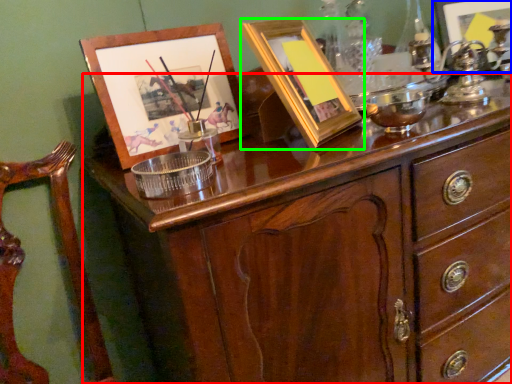
Question: Which object is positioned closest to chest of drawers (highlighted by a red box)? Select from picture frame (highlighted by a blue box) and picture frame (highlighted by a green box).

Choices:
 (A) picture frame
 (B) picture frame

Answer: (B)